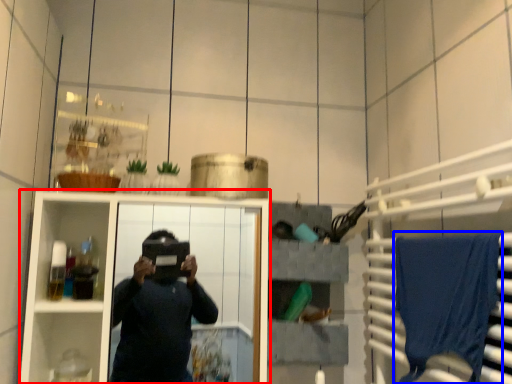
Question: Among these objects, which one is farthest to the camera, cabinetry (highlighted by a red box) or bath towel (highlighted by a blue box)?

Choices:
 (A) cabinetry
 (B) bath towel

Answer: (A)